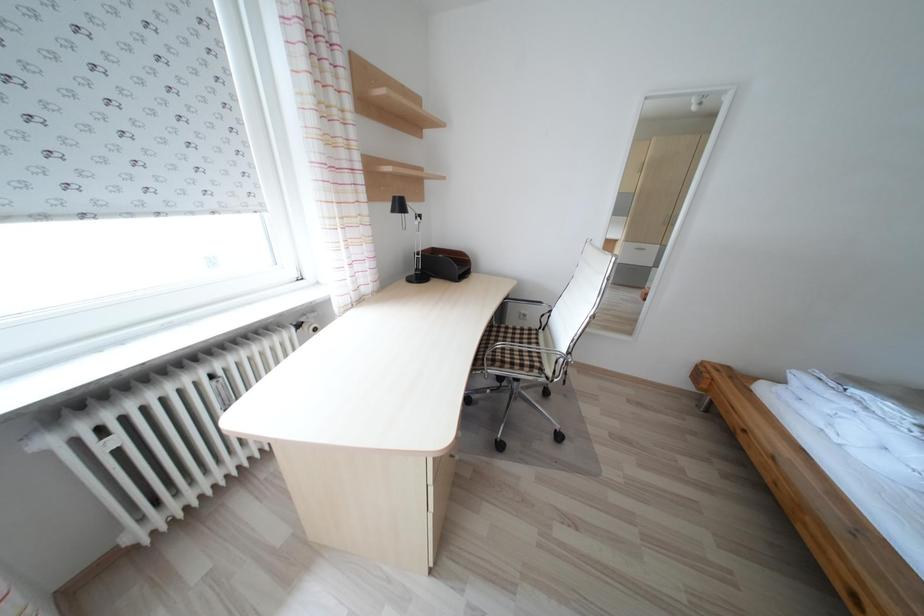
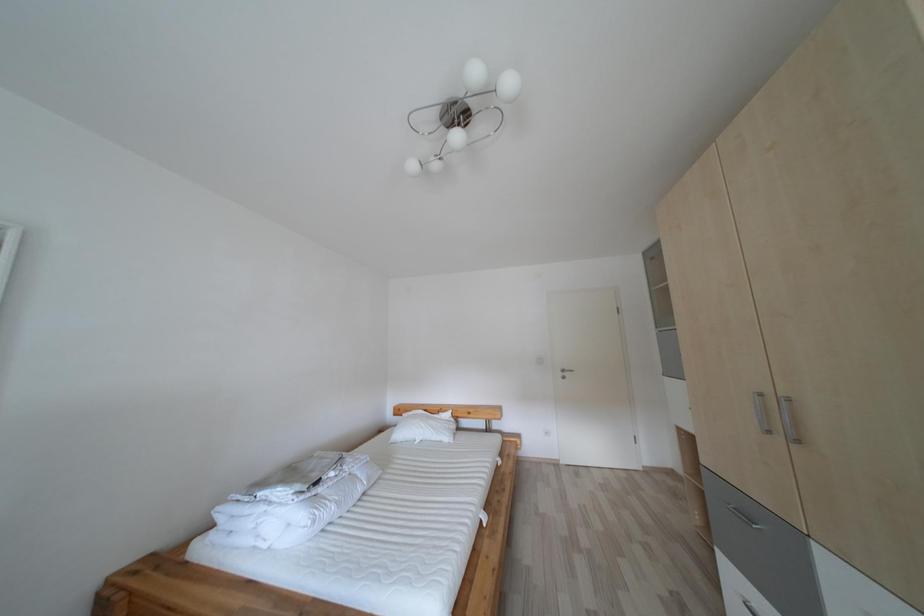
Question: The first image is from the beginning of the video and the second image is from the end. How did the camera likely rotate when shooting the video?

Choices:
 (A) Left
 (B) Right
 (C) Up
 (D) Down

Answer: (B)